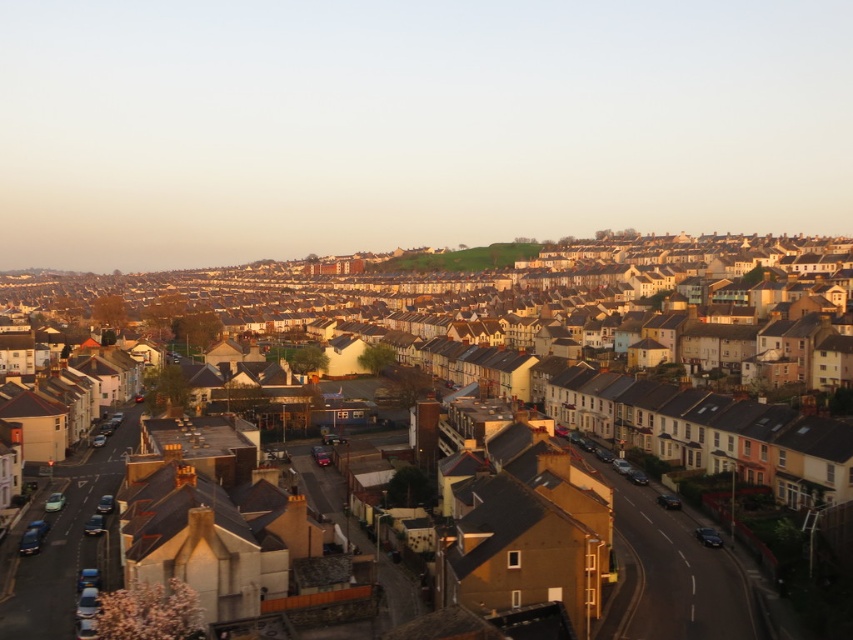
You are a drone operator flying a drone that needs to capture aerial footage of both the white matte houses at center and the green grassy hill at center. Based on their positions, which object should you focus on first to ensure the drone can capture both without needing to adjust its flight path significantly?

The white matte houses at center is in front of the green grassy hill at center, so you should focus on capturing the white matte houses at center first before moving on to the green grassy hill at center to ensure the drone can capture both without needing to adjust its flight path significantly.

You are standing at the edge of the green grassy hill at center and want to walk towards the white matte houses at center. Which direction should you head?

The white matte houses at center is positioned on the left side of green grassy hill at center, so you should head to the left to reach them.

You are a drone operator tasked with capturing aerial footage of the white matte houses at center and the green grassy hill at center. The drone has a maximum flight range of 120 meters. Can the drone safely capture footage of both locations without exceeding its range limit?

The white matte houses at center is 121.68 meters away from green grassy hill at center. Since the distance between them exceeds the drone operator maximum flight range of 120 meters, the drone cannot safely capture footage of both locations without exceeding its range limit.